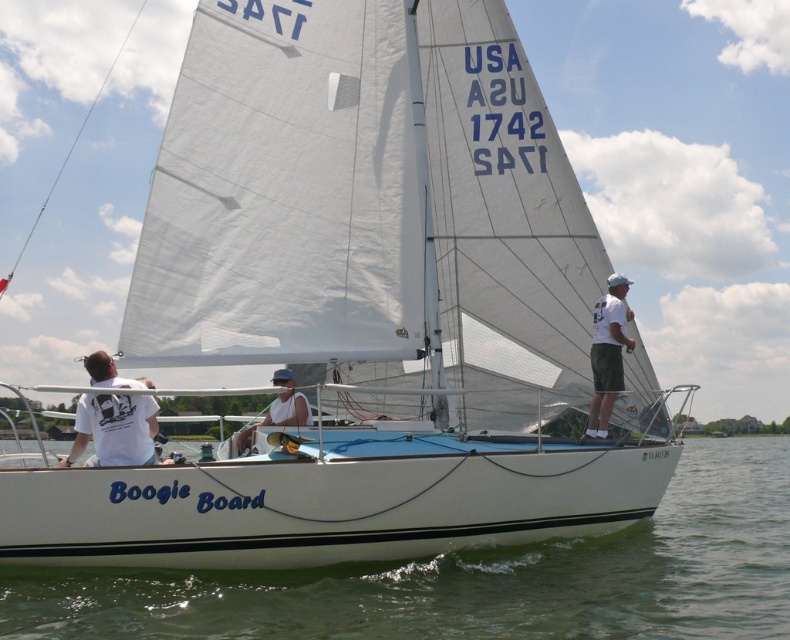
Question: Can you confirm if white water at center is thinner than white matte tank top at center?

Choices:
 (A) no
 (B) yes

Answer: (A)

Question: Does white matte sunglasses at center have a greater width compared to white matte tank top at center?

Choices:
 (A) no
 (B) yes

Answer: (A)

Question: Among these objects, which one is nearest to the camera?

Choices:
 (A) white matte tank top at center
 (B) white matte shirt at upper right
 (C) white matte t-shirt at lower left

Answer: (C)

Question: Which point is closer to the camera?

Choices:
 (A) (495, 566)
 (B) (623, 310)
 (C) (106, 364)

Answer: (C)

Question: Which point is farther to the camera?

Choices:
 (A) (151, 419)
 (B) (651, 522)
 (C) (275, 384)

Answer: (C)

Question: Can you confirm if white matte sunglasses at center is positioned to the right of white matte tank top at center?

Choices:
 (A) yes
 (B) no

Answer: (A)